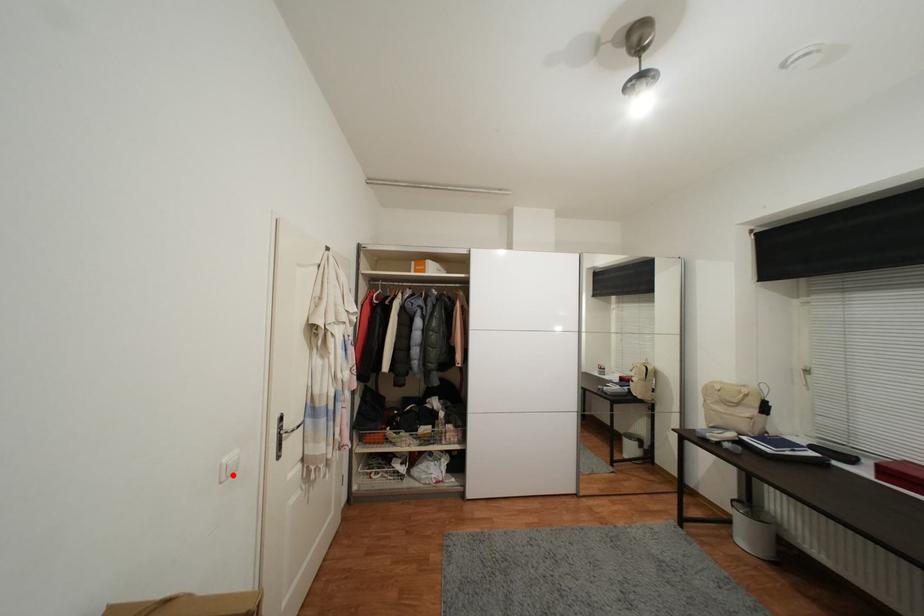
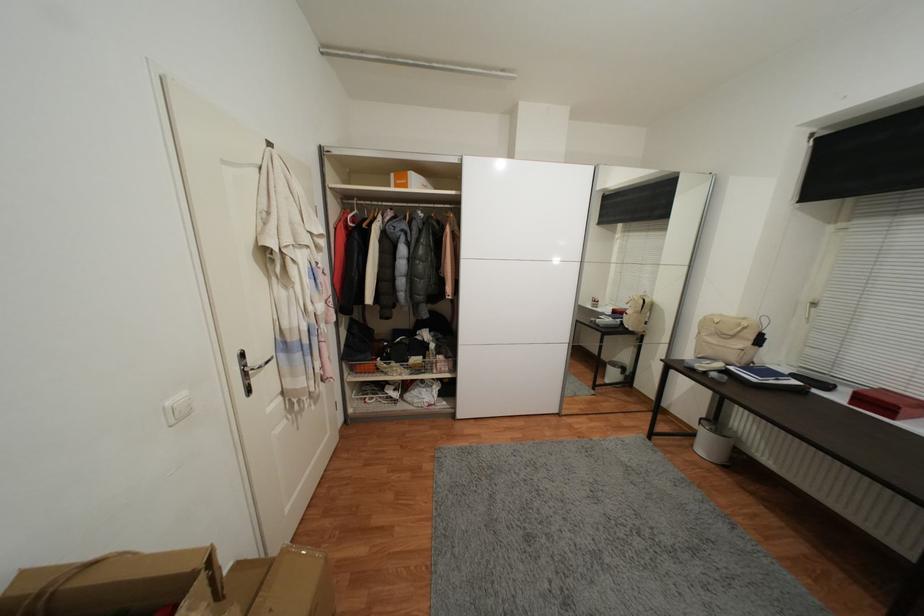
Locate, in the second image, the point that corresponds to the highlighted location in the first image.

(186, 416)